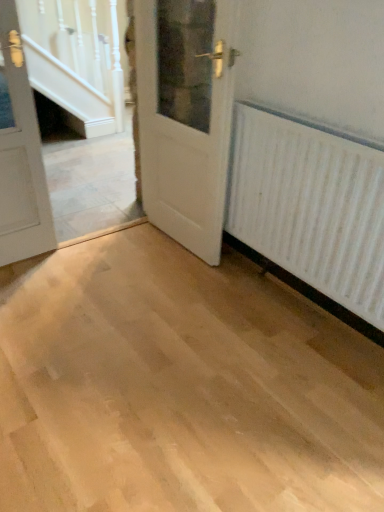
Question: Can you confirm if white wood door at left, the 1th door when ordered from left to right, is taller than white textured radiator at right?

Choices:
 (A) no
 (B) yes

Answer: (B)

Question: Considering the relative sizes of white wood door at left, the 2th door viewed from the right, and white textured radiator at right in the image provided, is white wood door at left, the 2th door viewed from the right, bigger than white textured radiator at right?

Choices:
 (A) no
 (B) yes

Answer: (A)

Question: Can you confirm if white wood door at left, the 2th door viewed from the right, is smaller than white textured radiator at right?

Choices:
 (A) no
 (B) yes

Answer: (B)

Question: Is white wood door at left, the 2th door viewed from the right, not inside white textured radiator at right?

Choices:
 (A) no
 (B) yes

Answer: (B)

Question: Can you confirm if white wood door at left, the 1th door when ordered from left to right, is positioned to the right of white textured radiator at right?

Choices:
 (A) yes
 (B) no

Answer: (B)

Question: From the image's perspective, relative to white textured radiator at right, is white wood door at left, the 1th door when ordered from left to right, above or below?

Choices:
 (A) above
 (B) below

Answer: (A)

Question: From their relative heights in the image, would you say white wood door at left, the 2th door viewed from the right, is taller or shorter than white textured radiator at right?

Choices:
 (A) short
 (B) tall

Answer: (B)

Question: Choose the correct answer: Is white wood door at left, the 2th door viewed from the right, inside white textured radiator at right or outside it?

Choices:
 (A) inside
 (B) outside

Answer: (B)

Question: From a real-world perspective, is white wood door at left, the 1th door when ordered from left to right, above or below white textured radiator at right?

Choices:
 (A) above
 (B) below

Answer: (A)

Question: In the image, is white wood door at center, the 1th door positioned from the right, positioned in front of or behind white wood door at left, the 2th door viewed from the right?

Choices:
 (A) front
 (B) behind

Answer: (B)

Question: Considering the positions of white wood door at center, placed as the 2th door when sorted from left to right, and white wood door at left, the 1th door when ordered from left to right, in the image, is white wood door at center, placed as the 2th door when sorted from left to right, bigger or smaller than white wood door at left, the 1th door when ordered from left to right,?

Choices:
 (A) big
 (B) small

Answer: (A)

Question: From a real-world perspective, is white wood door at center, placed as the 2th door when sorted from left to right, positioned above or below white wood door at left, the 2th door viewed from the right?

Choices:
 (A) below
 (B) above

Answer: (B)

Question: Visually, is white wood door at center, the 1th door positioned from the right, positioned to the left or to the right of white wood door at left, the 1th door when ordered from left to right?

Choices:
 (A) right
 (B) left

Answer: (A)

Question: From the image's perspective, is white textured radiator at right positioned above or below white wood door at center, the 1th door positioned from the right?

Choices:
 (A) above
 (B) below

Answer: (B)

Question: In terms of height, does white textured radiator at right look taller or shorter compared to white wood door at center, the 1th door positioned from the right?

Choices:
 (A) tall
 (B) short

Answer: (B)